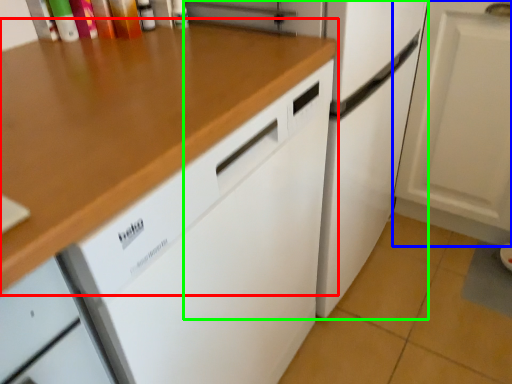
Question: Based on their relative distances, which object is farther from countertop (highlighted by a red box)? Choose from cabinetry (highlighted by a blue box) and refrigerator (highlighted by a green box).

Choices:
 (A) cabinetry
 (B) refrigerator

Answer: (A)